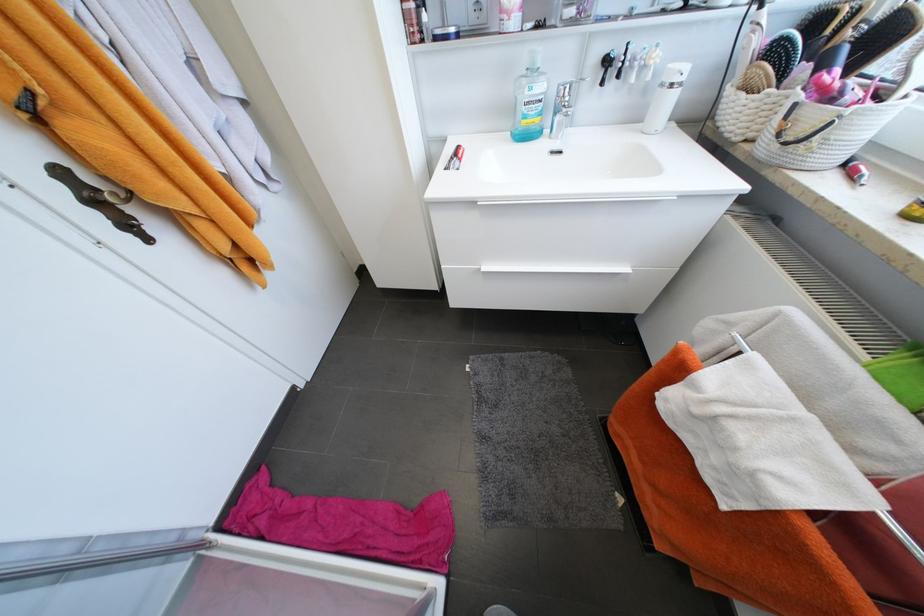
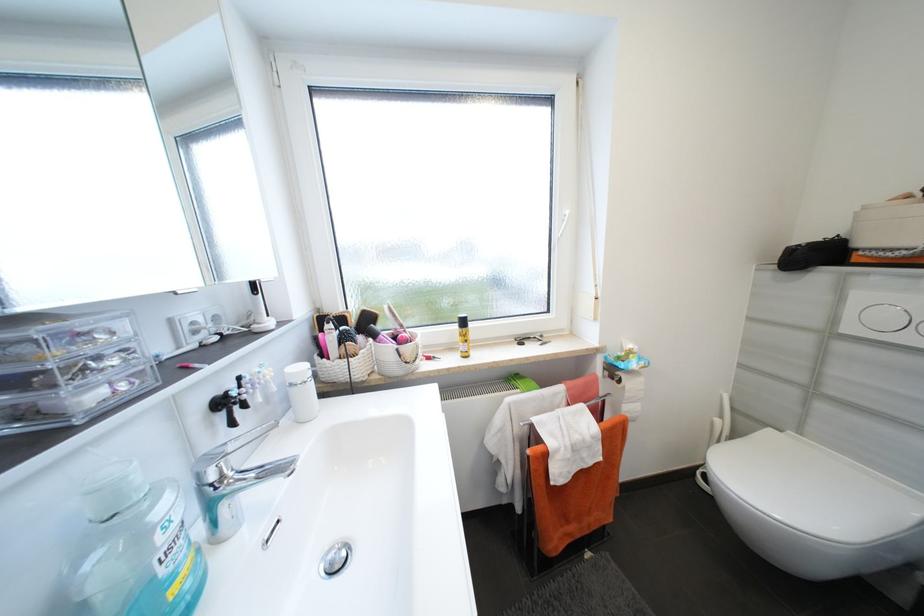
How did the camera likely rotate?

The rotation direction of the camera is right-down.